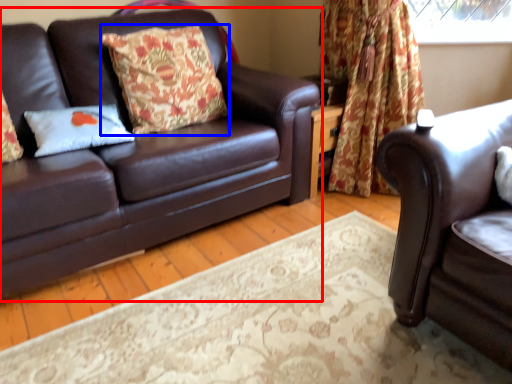
Question: Which object is closer to the camera taking this photo, studio couch (highlighted by a red box) or pillow (highlighted by a blue box)?

Choices:
 (A) studio couch
 (B) pillow

Answer: (A)